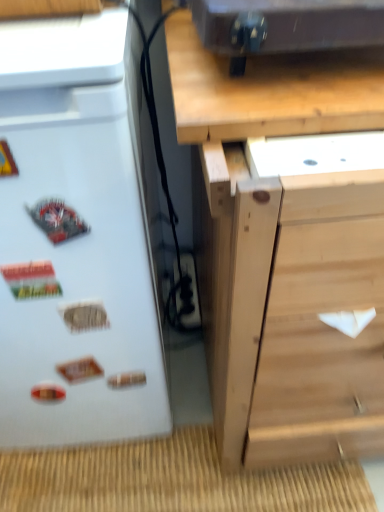
In order to face black plastic electric outlet at lower center, should I rotate leftwards or rightwards?

Turn left by 1.447 degrees to look at black plastic electric outlet at lower center.

At what (x,y) coordinates should I click in order to perform the action: click on white matte refrigerator at left. Please return your answer as a coordinate pair (x, y). The width and height of the screenshot is (384, 512). Looking at the image, I should click on (75, 240).

The height and width of the screenshot is (512, 384). Describe the element at coordinates (287, 252) in the screenshot. I see `natural wood chest of drawers at center` at that location.

I want to click on black plastic electric outlet at lower center, so click(x=187, y=292).

Can you confirm if natural wood chest of drawers at center is taller than metallic black speaker at upper center?

Yes.

From the image's perspective, who appears lower, natural wood chest of drawers at center or metallic black speaker at upper center?

natural wood chest of drawers at center appears lower in the image.

Is natural wood chest of drawers at center wider than metallic black speaker at upper center?

Correct, the width of natural wood chest of drawers at center exceeds that of metallic black speaker at upper center.

From a real-world perspective, between natural wood chest of drawers at center and metallic black speaker at upper center, who is vertically higher?

metallic black speaker at upper center, from a real-world perspective.

Locate an element on the screen. the chest of drawers located in front of the white matte refrigerator at left is located at coordinates (287, 252).

Is natural wood chest of drawers at center behind white matte refrigerator at left?

No, natural wood chest of drawers at center is in front of white matte refrigerator at left.

Is white matte refrigerator at left at the back of natural wood chest of drawers at center?

No, white matte refrigerator at left is not at the back of natural wood chest of drawers at center.

Looking at this image, is metallic black speaker at upper center positioned beyond the bounds of white matte refrigerator at left?

Absolutely, metallic black speaker at upper center is external to white matte refrigerator at left.

From the image's perspective, is metallic black speaker at upper center below white matte refrigerator at left?

No.

Considering the relative positions of metallic black speaker at upper center and white matte refrigerator at left in the image provided, is metallic black speaker at upper center to the right of white matte refrigerator at left from the viewer's perspective?

Indeed, metallic black speaker at upper center is positioned on the right side of white matte refrigerator at left.

Considering the relative sizes of metallic black speaker at upper center and white matte refrigerator at left in the image provided, is metallic black speaker at upper center smaller than white matte refrigerator at left?

Indeed, metallic black speaker at upper center has a smaller size compared to white matte refrigerator at left.

Based on the photo, who is more distant, natural wood chest of drawers at center or black plastic electric outlet at lower center?

Positioned behind is black plastic electric outlet at lower center.

Considering the relative sizes of natural wood chest of drawers at center and black plastic electric outlet at lower center in the image provided, is natural wood chest of drawers at center wider than black plastic electric outlet at lower center?

Result: Yes, natural wood chest of drawers at center is wider than black plastic electric outlet at lower center.

From the picture: Can you tell me how much natural wood chest of drawers at center and black plastic electric outlet at lower center differ in facing direction?

1.04 degrees separate the facing orientations of natural wood chest of drawers at center and black plastic electric outlet at lower center.

In order to click on electric outlet below the natural wood chest of drawers at center (from a real-world perspective) in this screenshot , I will do `click(187, 292)`.

Would you consider metallic black speaker at upper center to be distant from natural wood chest of drawers at center?

metallic black speaker at upper center is near natural wood chest of drawers at center, not far away.

From the image's perspective, is metallic black speaker at upper center under natural wood chest of drawers at center?

Incorrect, from the image's perspective, metallic black speaker at upper center is higher than natural wood chest of drawers at center.

Is metallic black speaker at upper center to the left of natural wood chest of drawers at center from the viewer's perspective?

Indeed, metallic black speaker at upper center is positioned on the left side of natural wood chest of drawers at center.

Is metallic black speaker at upper center smaller than natural wood chest of drawers at center?

Yes, metallic black speaker at upper center is smaller than natural wood chest of drawers at center.

Does white matte refrigerator at left have a lesser width compared to black plastic electric outlet at lower center?

Incorrect, the width of white matte refrigerator at left is not less than that of black plastic electric outlet at lower center.

The height and width of the screenshot is (512, 384). I want to click on electric outlet located on the right of white matte refrigerator at left, so click(x=187, y=292).

Is white matte refrigerator at left positioned far away from black plastic electric outlet at lower center?

They are positioned close to each other.

Is metallic black speaker at upper center bigger than black plastic electric outlet at lower center?

Yes.

At what (x,y) coordinates should I click in order to perform the action: click on appliance above the black plastic electric outlet at lower center (from a real-world perspective). Please return your answer as a coordinate pair (x, y). The width and height of the screenshot is (384, 512). Looking at the image, I should click on (286, 26).

What are the coordinates of `chest of drawers on the right of the metallic black speaker at upper center` in the screenshot? It's located at (287, 252).

Image resolution: width=384 pixels, height=512 pixels. Identify the location of chest of drawers below the white matte refrigerator at left (from a real-world perspective). (287, 252).

Considering their positions, is metallic black speaker at upper center positioned closer to black plastic electric outlet at lower center than white matte refrigerator at left?

Based on the image, white matte refrigerator at left appears to be nearer to black plastic electric outlet at lower center.

From the image, which object appears to be nearer to black plastic electric outlet at lower center, white matte refrigerator at left or natural wood chest of drawers at center?

Among the two, white matte refrigerator at left is located nearer to black plastic electric outlet at lower center.

When comparing their distances from black plastic electric outlet at lower center, does white matte refrigerator at left or metallic black speaker at upper center seem closer?

The object closer to black plastic electric outlet at lower center is white matte refrigerator at left.

Looking at the image, which one is located further to natural wood chest of drawers at center, metallic black speaker at upper center or white matte refrigerator at left?

metallic black speaker at upper center.

Considering their positions, is black plastic electric outlet at lower center positioned closer to metallic black speaker at upper center than white matte refrigerator at left?

Among the two, white matte refrigerator at left is located nearer to metallic black speaker at upper center.

Estimate the real-world distances between objects in this image. Which object is further from metallic black speaker at upper center, black plastic electric outlet at lower center or natural wood chest of drawers at center?

Based on the image, black plastic electric outlet at lower center appears to be further to metallic black speaker at upper center.

Based on the photo, which object lies further to the anchor point black plastic electric outlet at lower center, natural wood chest of drawers at center or white matte refrigerator at left?

The object further to black plastic electric outlet at lower center is natural wood chest of drawers at center.

Which object lies further to the anchor point natural wood chest of drawers at center, white matte refrigerator at left or black plastic electric outlet at lower center?

black plastic electric outlet at lower center lies further to natural wood chest of drawers at center than the other object.

Image resolution: width=384 pixels, height=512 pixels. What are the coordinates of `refrigerator between natural wood chest of drawers at center and black plastic electric outlet at lower center from front to back` in the screenshot? It's located at (75, 240).

Where is `appliance positioned between white matte refrigerator at left and black plastic electric outlet at lower center from near to far`? This screenshot has height=512, width=384. appliance positioned between white matte refrigerator at left and black plastic electric outlet at lower center from near to far is located at coordinates point(286,26).

This screenshot has width=384, height=512. Identify the location of appliance situated between white matte refrigerator at left and natural wood chest of drawers at center from left to right. (286, 26).

Find the location of `appliance between natural wood chest of drawers at center and black plastic electric outlet at lower center along the z-axis`. appliance between natural wood chest of drawers at center and black plastic electric outlet at lower center along the z-axis is located at coordinates (286, 26).